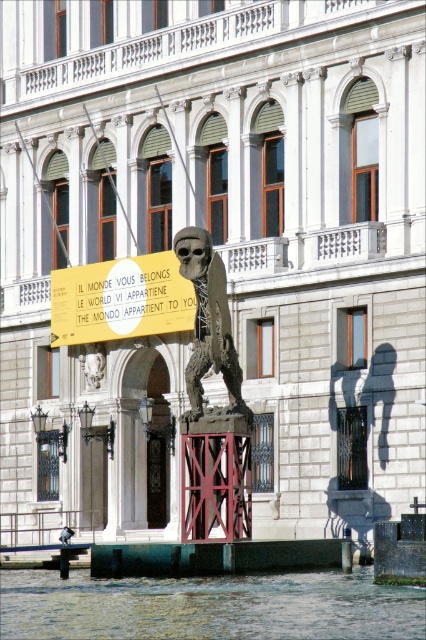
Measure the distance between point (x=190, y=611) and camera.

Point (x=190, y=611) and camera are 57.90 meters apart from each other.

Is point (134, 602) positioned after point (138, 317)?

No, it is not.

Who is more distant from viewer, (284, 612) or (150, 285)?

Point (150, 285)

Identify the location of clear water at lower center. (209, 605).

Who is taller, clear water at lower center or rustic bronze skeleton at center?

rustic bronze skeleton at center is taller.

What do you see at coordinates (209, 605) in the screenshot? The width and height of the screenshot is (426, 640). I see `clear water at lower center` at bounding box center [209, 605].

Locate an element on the screen. clear water at lower center is located at coordinates (209, 605).

Where is `clear water at lower center`? This screenshot has height=640, width=426. clear water at lower center is located at coordinates (209, 605).

Which of these two, yellow matte sign at center or rustic bronze skeleton at center, stands shorter?

With less height is yellow matte sign at center.

Between yellow matte sign at center and rustic bronze skeleton at center, which one has more height?

With more height is rustic bronze skeleton at center.

Find the location of `yellow matte sign at center`. yellow matte sign at center is located at coordinates (120, 300).

The height and width of the screenshot is (640, 426). In order to click on yellow matte sign at center in this screenshot , I will do `click(120, 300)`.